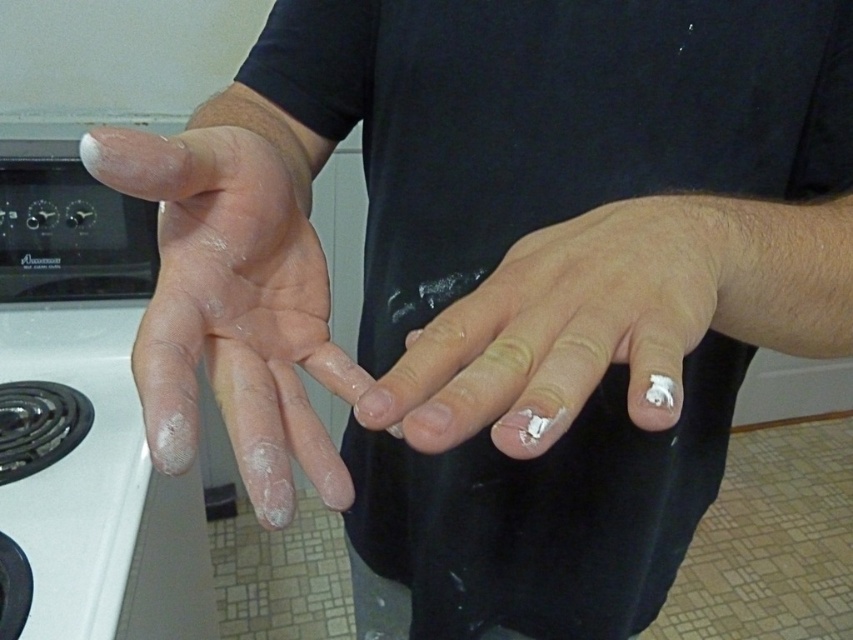
This screenshot has height=640, width=853. What do you see at coordinates (235, 300) in the screenshot?
I see `white matte hand at center` at bounding box center [235, 300].

Which of these two, white matte hand at center or white matte nails at center, stands taller?

With more height is white matte hand at center.

Who is more distant from viewer, (183, 458) or (587, 250)?

Point (587, 250)

The image size is (853, 640). Find the location of `white matte hand at center`. white matte hand at center is located at coordinates (235, 300).